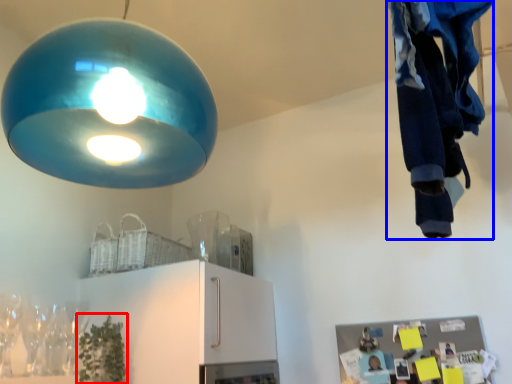
Question: Which point is further to the camera, plant (highlighted by a red box) or clothing (highlighted by a blue box)?

Choices:
 (A) plant
 (B) clothing

Answer: (A)